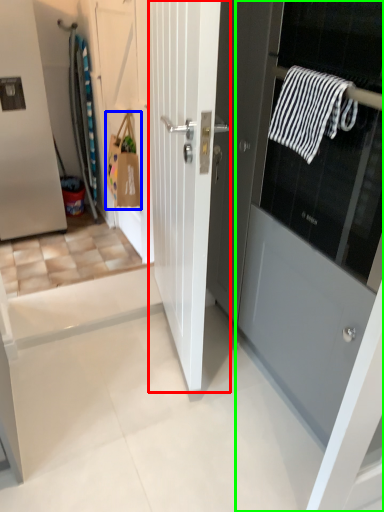
Question: Which is nearer to the door (highlighted by a red box)? shopping bag (highlighted by a blue box) or door (highlighted by a green box).

Choices:
 (A) shopping bag
 (B) door

Answer: (B)